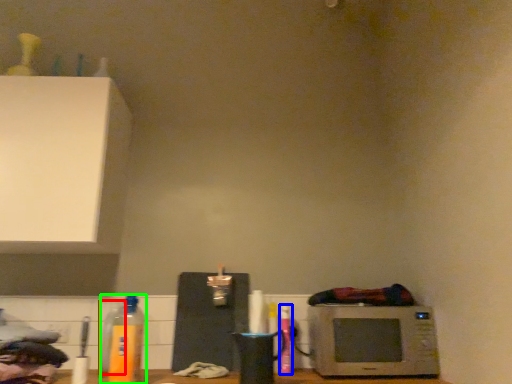
Question: Considering the real-world distances, which object is farthest from bottle (highlighted by a red box)? bottle (highlighted by a blue box) or bottle (highlighted by a green box)?

Choices:
 (A) bottle
 (B) bottle

Answer: (A)